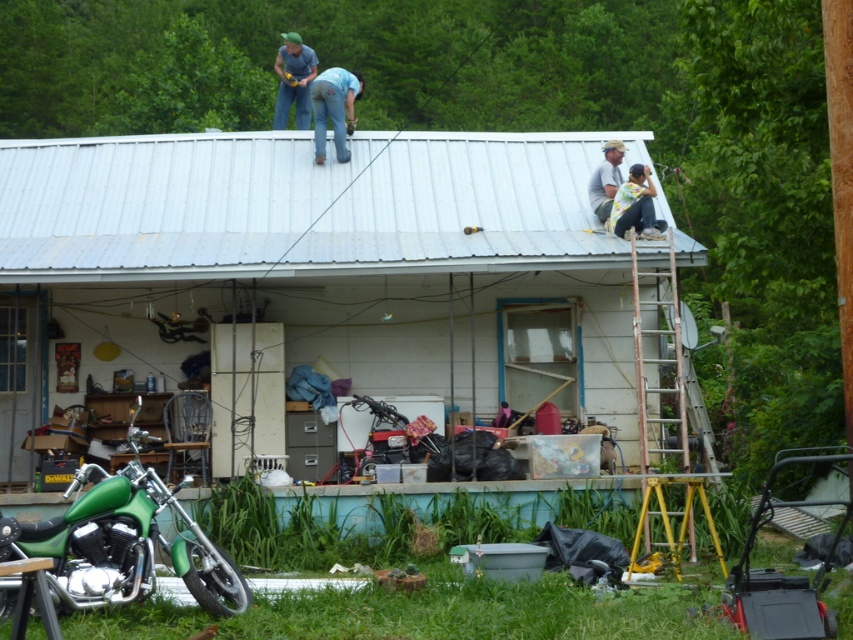
Who is higher up, metallic silver roof at upper center or rusty metal ladder at right?

metallic silver roof at upper center is higher up.

Where is `metallic silver roof at upper center`? Image resolution: width=853 pixels, height=640 pixels. metallic silver roof at upper center is located at coordinates (299, 204).

Is point (534, 145) farther from camera compared to point (660, 458)?

Yes, it is behind point (660, 458).

Locate an element on the screen. metallic silver roof at upper center is located at coordinates (299, 204).

Which is in front, point (492, 205) or point (351, 109)?

Point (492, 205) is more forward.

Measure the distance between metallic silver roof at upper center and camera.

A distance of 14.45 meters exists between metallic silver roof at upper center and camera.

Does point (463, 132) come farther from viewer compared to point (322, 72)?

No, (463, 132) is in front of (322, 72).

Where is `metallic silver roof at upper center`? This screenshot has height=640, width=853. metallic silver roof at upper center is located at coordinates (299, 204).

The width and height of the screenshot is (853, 640). What do you see at coordinates (128, 541) in the screenshot? I see `green matte motorcycle at lower left` at bounding box center [128, 541].

Who is positioned more to the right, green matte motorcycle at lower left or rusty metal ladder at right?

Positioned to the right is rusty metal ladder at right.

I want to click on green matte motorcycle at lower left, so click(x=128, y=541).

Where is `green matte motorcycle at lower left`? This screenshot has width=853, height=640. green matte motorcycle at lower left is located at coordinates (128, 541).